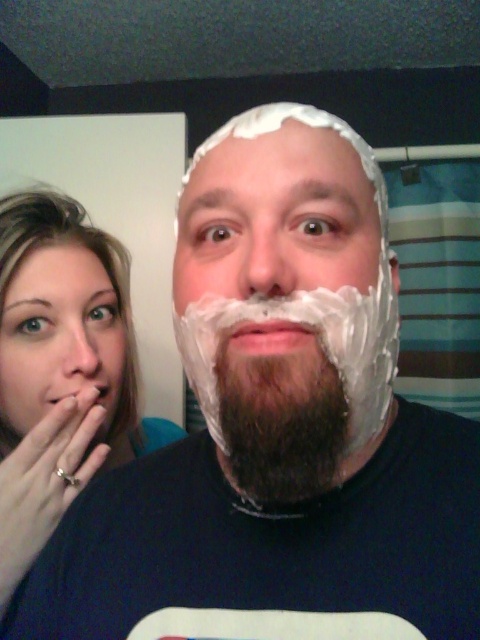
You are a photographer setting up a shot in this bathroom scene. You need to ensure that the blonde hair at left and the matte skin at left are at least 2 inches apart to avoid blurring in the final image. Based on the current positioning, will this requirement be met?

The blonde hair at left is 1.55 inches from matte skin at left, which is less than the required 2 inches. Therefore, the requirement will not be met, and there may be blurring between the two elements in the final image.